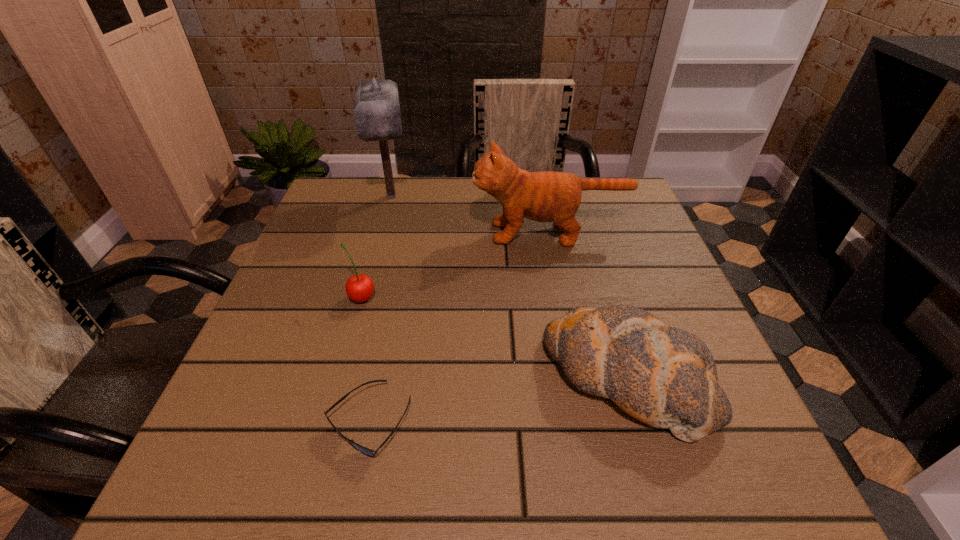
Where is `free point located 0.210m on the face of the cat`? This screenshot has width=960, height=540. free point located 0.210m on the face of the cat is located at coordinates (383, 233).

I want to click on free space located 0.220m on the front of the cherry, so click(331, 410).

Find the location of a particular element. vacant space located 0.170m on the left of the bread is located at coordinates (444, 379).

You are a GUI agent. You are given a task and a screenshot of the screen. Output one action in this format:
    pyautogui.click(x=<x>, y=<y>)
    Task: Click on the vacant space located at the front of the shortest object showing the lenses
    This screenshot has width=960, height=540.
    Given the screenshot: What is the action you would take?
    pyautogui.click(x=353, y=500)

The image size is (960, 540). I want to click on mallet that is at the far edge, so click(376, 109).

Identify the location of cat present at the far edge. This screenshot has width=960, height=540. (548, 196).

Find the location of `bread that is at the near edge`. bread that is at the near edge is located at coordinates (663, 376).

I want to click on sunglasses that is at the near edge, so click(x=368, y=452).

Where is `mallet positioned at the left edge`? mallet positioned at the left edge is located at coordinates (376, 109).

Where is `cherry positioned at the left edge`? cherry positioned at the left edge is located at coordinates (359, 288).